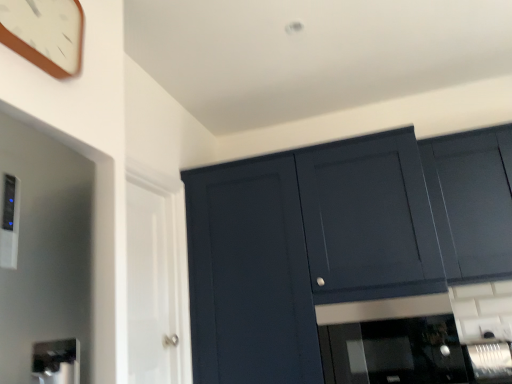
Question: Is matte dark blue cabinet at upper right inside wooden clock at upper left?

Choices:
 (A) yes
 (B) no

Answer: (B)

Question: Is wooden clock at upper left shorter than matte dark blue cabinet at upper right?

Choices:
 (A) no
 (B) yes

Answer: (B)

Question: Is wooden clock at upper left to the left of matte dark blue cabinet at upper right from the viewer's perspective?

Choices:
 (A) no
 (B) yes

Answer: (B)

Question: Considering the relative positions of wooden clock at upper left and matte dark blue cabinet at upper right in the image provided, is wooden clock at upper left behind matte dark blue cabinet at upper right?

Choices:
 (A) yes
 (B) no

Answer: (B)

Question: Is wooden clock at upper left not near matte dark blue cabinet at upper right?

Choices:
 (A) yes
 (B) no

Answer: (A)

Question: Could you tell me if wooden clock at upper left is facing matte dark blue cabinet at upper right?

Choices:
 (A) yes
 (B) no

Answer: (B)

Question: Is matte dark blue cabinet at upper right further to the viewer compared to wooden clock at upper left?

Choices:
 (A) no
 (B) yes

Answer: (B)

Question: Can you confirm if matte dark blue cabinet at upper right is smaller than wooden clock at upper left?

Choices:
 (A) yes
 (B) no

Answer: (B)

Question: Is matte dark blue cabinet at upper right bigger than wooden clock at upper left?

Choices:
 (A) yes
 (B) no

Answer: (A)

Question: Would you consider matte dark blue cabinet at upper right to be distant from wooden clock at upper left?

Choices:
 (A) no
 (B) yes

Answer: (B)

Question: From the image's perspective, is matte dark blue cabinet at upper right beneath wooden clock at upper left?

Choices:
 (A) no
 (B) yes

Answer: (B)

Question: Is matte dark blue cabinet at upper right to the right of wooden clock at upper left from the viewer's perspective?

Choices:
 (A) no
 (B) yes

Answer: (B)

Question: Is white glossy door at left not inside matte dark blue cabinet at upper right?

Choices:
 (A) yes
 (B) no

Answer: (A)